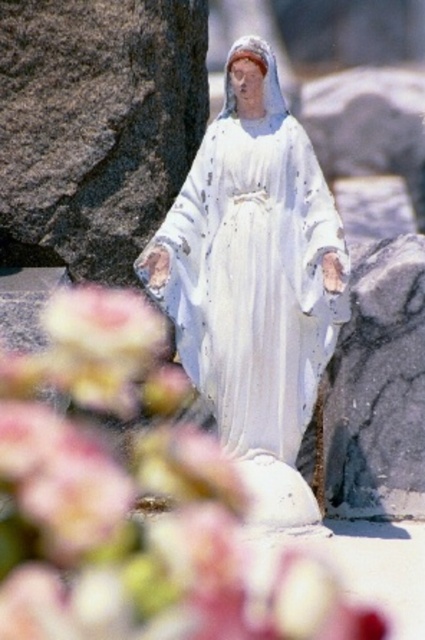
Between blurred floral petals at center and white glossy statue at center, which one appears on the right side from the viewer's perspective?

white glossy statue at center is more to the right.

Find the location of a particular element. The image size is (425, 640). blurred floral petals at center is located at coordinates (133, 500).

I want to click on blurred floral petals at center, so click(x=133, y=500).

You are a GUI agent. You are given a task and a screenshot of the screen. Output one action in this format:
    pyautogui.click(x=<x>, y=<y>)
    Task: Click on the blurred floral petals at center
    Image resolution: width=425 pixels, height=640 pixels.
    Given the screenshot: What is the action you would take?
    pyautogui.click(x=133, y=500)